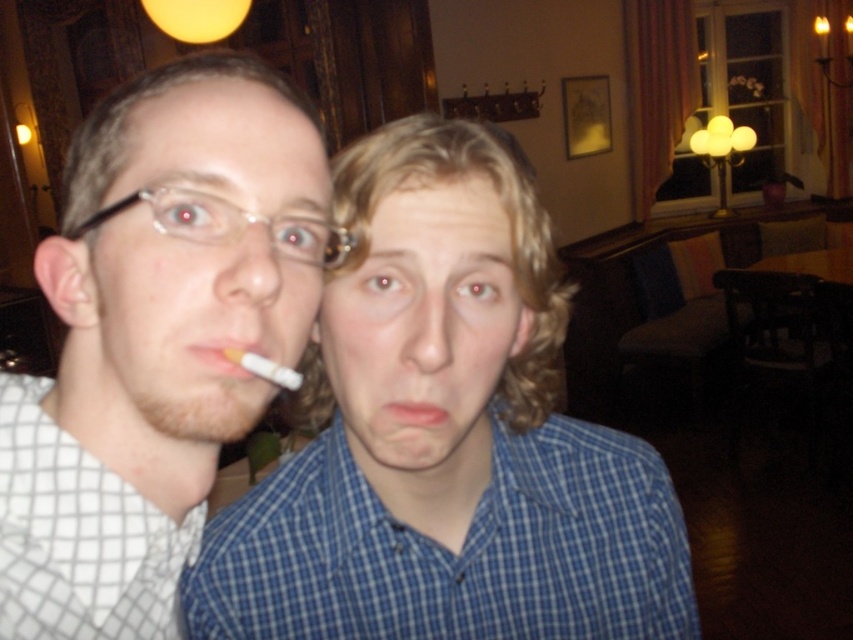
Question: Which object is farther from the camera taking this photo?

Choices:
 (A) yellow matte cigarette at center
 (B) pink matte lips at center

Answer: (B)

Question: Considering the real-world distances, which object is closest to the yellow matte cigarette at center?

Choices:
 (A) pink matte lips at center
 (B) white checkered shirt at left

Answer: (A)

Question: Is white checkered shirt at left further to the viewer compared to yellow matte cigarette at center?

Choices:
 (A) yes
 (B) no

Answer: (B)

Question: Can you confirm if yellow matte cigarette at center is thinner than pink matte lips at center?

Choices:
 (A) no
 (B) yes

Answer: (A)

Question: Which point is farther from the camera taking this photo?

Choices:
 (A) (409, 403)
 (B) (10, 520)

Answer: (A)

Question: Where is yellow matte cigarette at center located in relation to pink matte lips at center in the image?

Choices:
 (A) right
 (B) left

Answer: (B)